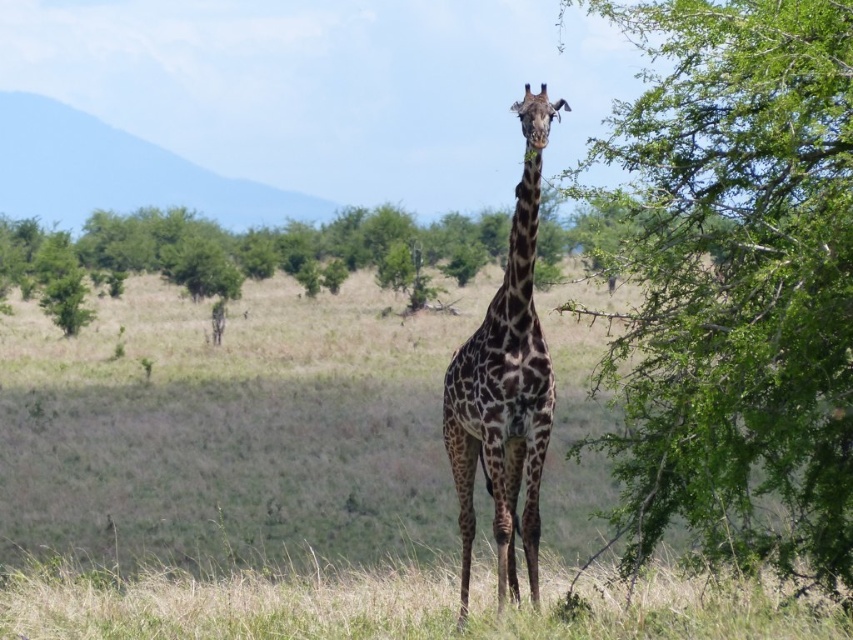
Does green leafy tree at right have a greater width compared to spotted fur giraffe at center?

Yes.

Which is behind, point (814, 26) or point (531, 221)?

Point (531, 221)

This screenshot has width=853, height=640. I want to click on green leafy tree at right, so click(x=735, y=278).